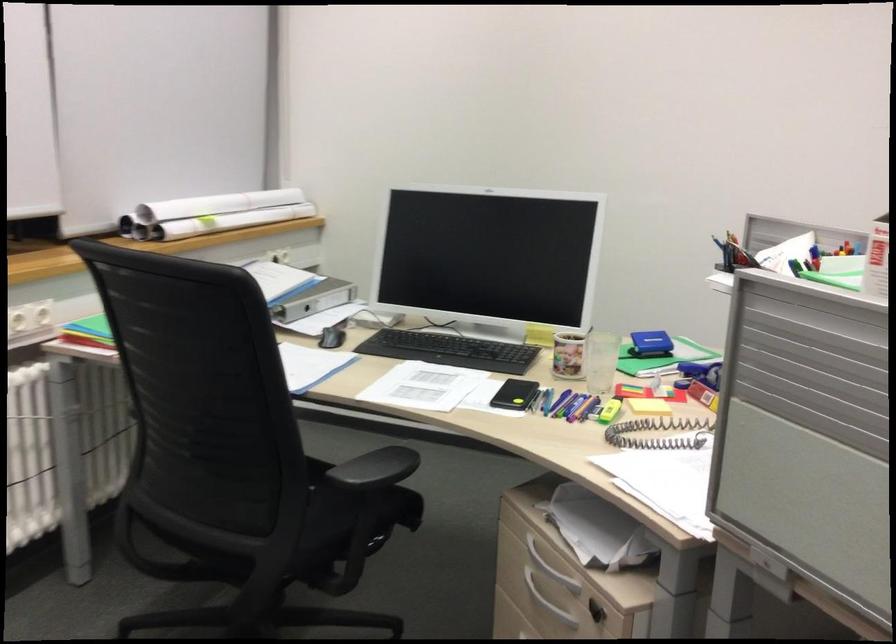
Where would you push the blue stapler? Please return your answer as a coordinate pair (x, y).

(650, 344)